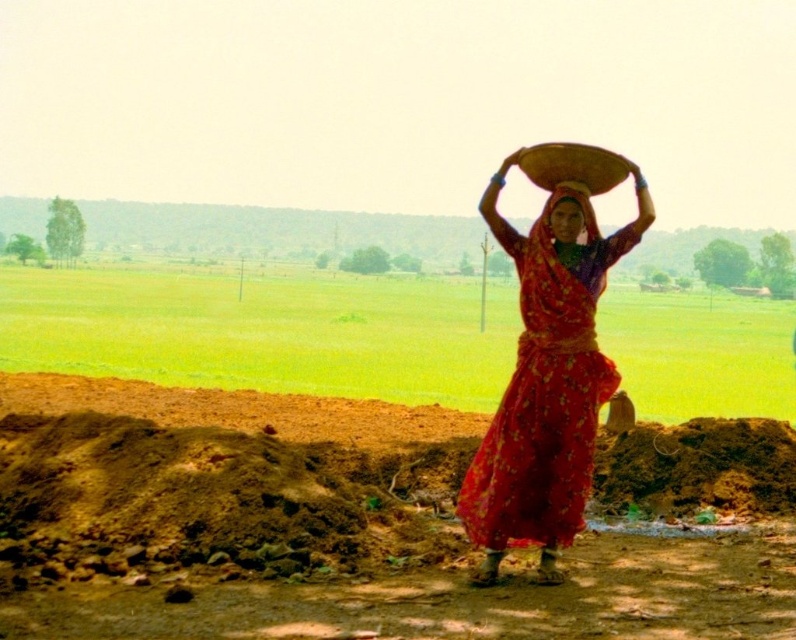
You are a photographer planning to capture the scene of a woman carrying a basket in a rural setting. You notice the brown soil at center and the matte red fabric at center. Which object should you focus on first to ensure it appears sharp in your photo if you want the background to be blurry?

You should focus on the matte red fabric at center first because it is behind the brown soil at center, so focusing on the matte red fabric at center will keep it sharp while the brown soil at center and foreground elements may blur.

You are a photographer planning to capture the scene with the woman and her basket. Given that the brown soil at center and the matte red fabric at center are both in the frame, which one occupies more visual space in the image?

The brown soil at center is larger in size than the matte red fabric at center, so it occupies more visual space in the image.

You are a photographer planning to capture the woman in the scene. You want to ensure that both the brown soil at center and the matte red fabric at center are clearly visible in your shot. Based on their positions, which object will appear closer to the camera?

The matte red fabric at center appears closer to the camera because it is taller than the brown soil at center, which is shorter.